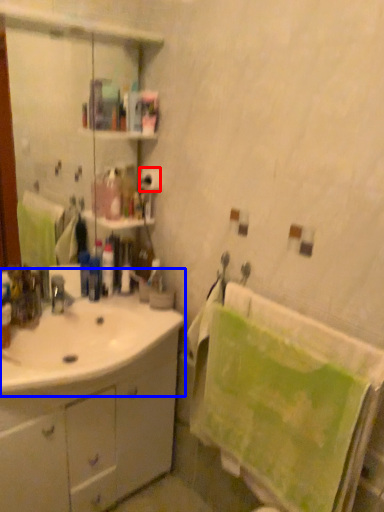
Question: Which object is closer to the camera taking this photo, toilet paper (highlighted by a red box) or sink (highlighted by a blue box)?

Choices:
 (A) toilet paper
 (B) sink

Answer: (B)